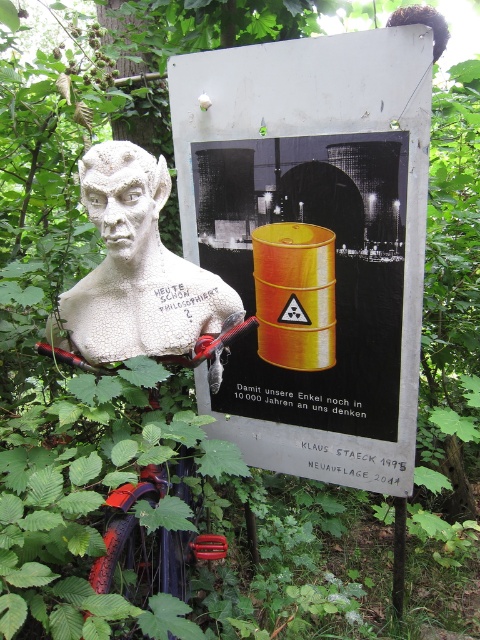
You are standing in front of the sculpture and signboard. Which object, the metallic yellow barrel at center or the white textured bust at left, is closer to you?

The metallic yellow barrel at center is closer to you because it is further to the viewer than the white textured bust at left.

You are an art student standing in front of the sculpture and signboard. You want to take a photo of the white textured bust at left without including the metallic yellow barrel at center in the frame. Which direction should you move to achieve this?

Move to the left side of the white textured bust at left so that the metallic yellow barrel at center is out of the frame.

You are standing in front of the sculpture and the signboard. You see a point at coordinate (314, 228). What object is located at that point?

The point at coordinate (314, 228) indicates the metallic yellow barrel at center.